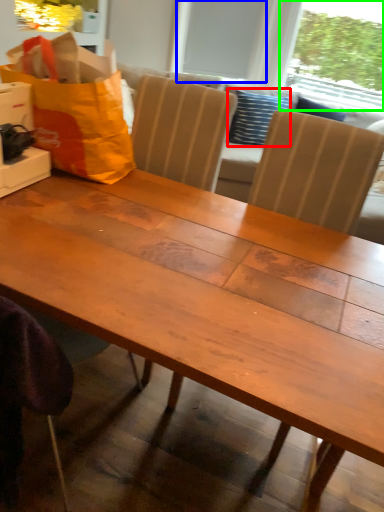
Question: Which is farther away from pillow (highlighted by a red box)? window screen (highlighted by a blue box) or window screen (highlighted by a green box)?

Choices:
 (A) window screen
 (B) window screen

Answer: (B)